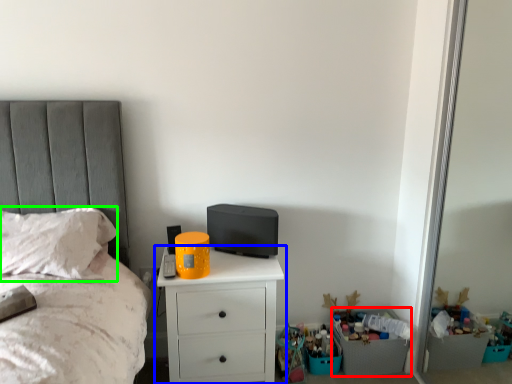
Question: Based on their relative distances, which object is nearer to crate (highlighted by a red box)? Choose from chest of drawers (highlighted by a blue box) and pillow (highlighted by a green box).

Choices:
 (A) chest of drawers
 (B) pillow

Answer: (A)